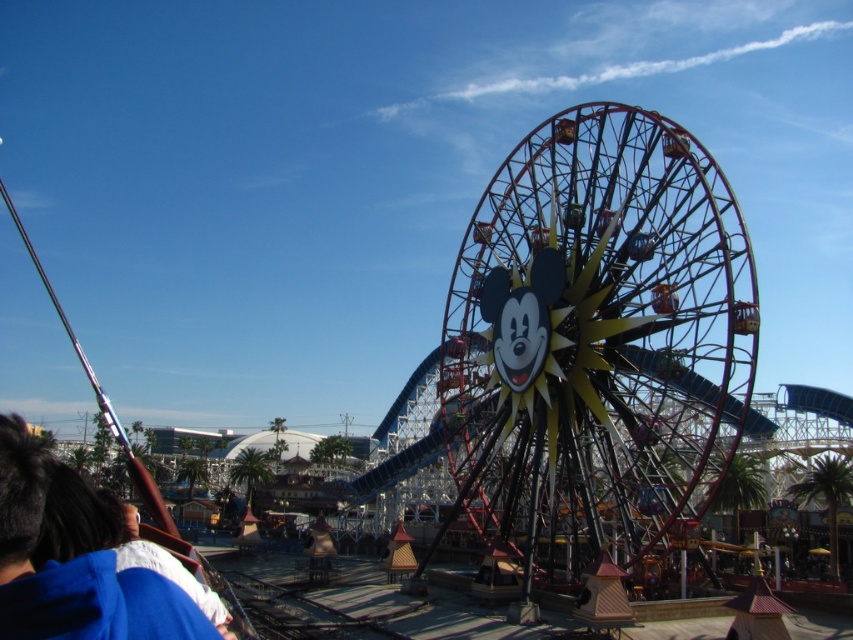
Question: Which object is farther from the camera taking this photo?

Choices:
 (A) blue fabric at lower left
 (B) metallic ferris wheel at center

Answer: (B)

Question: Is metallic ferris wheel at center positioned in front of blue fabric at lower left?

Choices:
 (A) no
 (B) yes

Answer: (A)

Question: Which point is farther to the camera?

Choices:
 (A) blue fabric at lower left
 (B) metallic ferris wheel at center

Answer: (B)

Question: Observing the image, what is the correct spatial positioning of metallic ferris wheel at center in reference to blue fabric at lower left?

Choices:
 (A) above
 (B) below

Answer: (A)

Question: In this image, where is metallic ferris wheel at center located relative to blue fabric at lower left?

Choices:
 (A) right
 (B) left

Answer: (A)